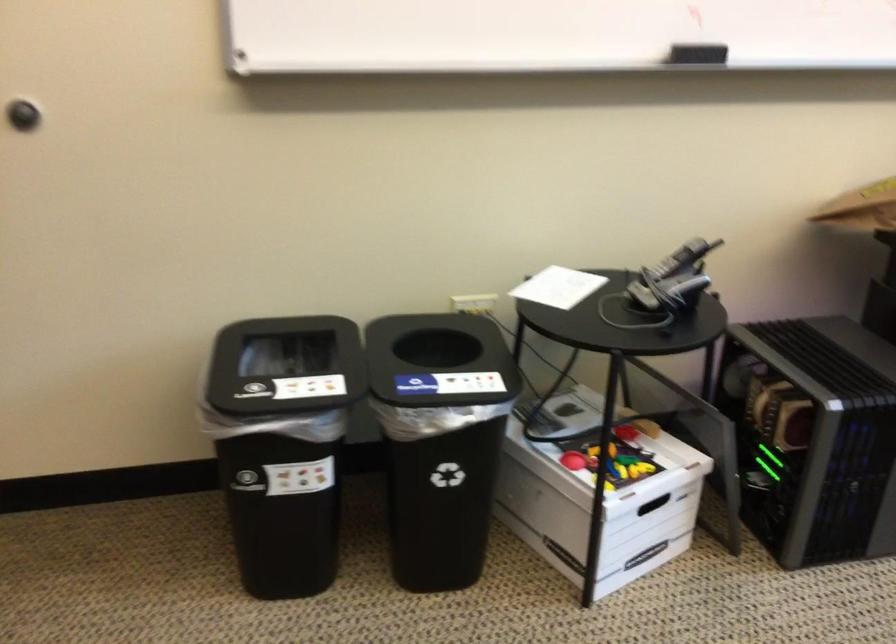
Image resolution: width=896 pixels, height=644 pixels. What are the coordinates of `storage box handle` in the screenshot? It's located at (599, 495).